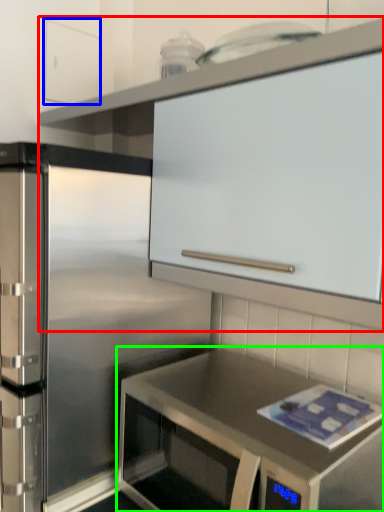
Question: Considering the real-world distances, which object is farthest from cabinetry (highlighted by a red box)? cabinetry (highlighted by a blue box) or countertop (highlighted by a green box)?

Choices:
 (A) cabinetry
 (B) countertop

Answer: (B)